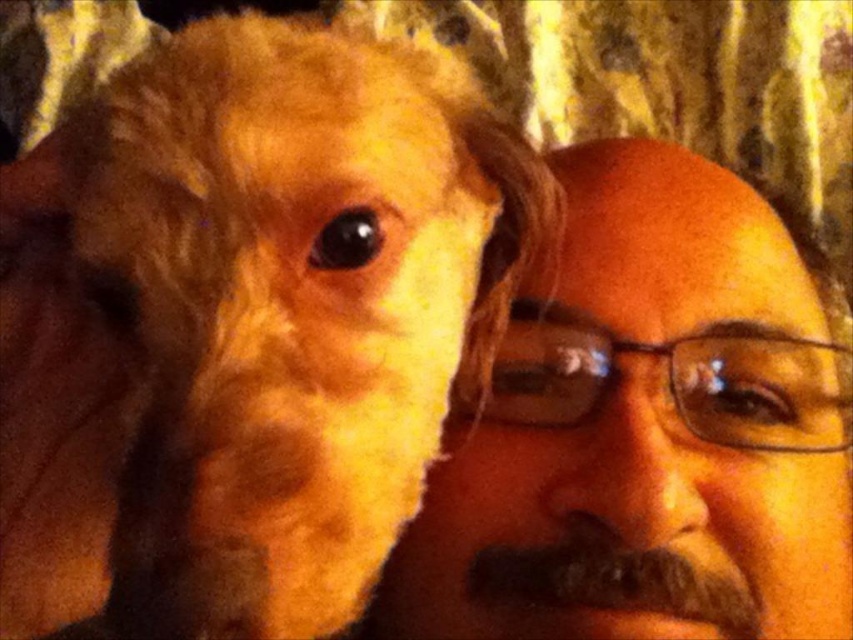
You are an artist sketching this scene. You need to draw the fuzzy golden dog at left and the smooth skin face at center. Which one should you draw first if you want to follow the natural order from top to bottom?

The fuzzy golden dog at left should be drawn first because it is located above the smooth skin face at center, following the top to bottom order.

You are a photographer trying to capture a portrait of the fuzzy golden dog at left and the smooth skin face at center. Since the background is blurred, can you tell which subject is closer to the camera based on their positions?

The fuzzy golden dog at left is in front of the smooth skin face at center, so the fuzzy golden dog at left is closer to the camera.

You are standing in front of the image and want to touch the point at coordinates point (357, 572). If your finger is 0.5 inches wide, will it cover the entire point?

The point (357, 572) and viewer are 12.14 inches apart. Since your finger is 0.5 inches wide, it will not cover the entire point because the distance is much larger than the finger width.